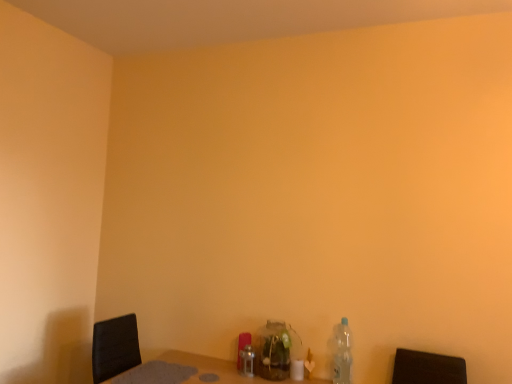
Question: From the image's perspective, would you say clear plastic bottle at lower right, marked as the third bottle in a left-to-right arrangement, is positioned over translucent glass jar at center, the 2th bottle in the right-to-left sequence?

Choices:
 (A) no
 (B) yes

Answer: (B)

Question: Could you tell me if clear plastic bottle at lower right, marked as the third bottle in a left-to-right arrangement, is turned towards translucent glass jar at center, placed as the second bottle when sorted from left to right?

Choices:
 (A) no
 (B) yes

Answer: (A)

Question: Is there a large distance between clear plastic bottle at lower right, the first bottle viewed from the right, and translucent glass jar at center, the 2th bottle in the right-to-left sequence?

Choices:
 (A) no
 (B) yes

Answer: (A)

Question: Is clear plastic bottle at lower right, the first bottle viewed from the right, further to the viewer compared to translucent glass jar at center, the 2th bottle in the right-to-left sequence?

Choices:
 (A) yes
 (B) no

Answer: (B)

Question: Is clear plastic bottle at lower right, marked as the third bottle in a left-to-right arrangement, at the right side of translucent glass jar at center, the 2th bottle in the right-to-left sequence?

Choices:
 (A) no
 (B) yes

Answer: (B)

Question: From the image's perspective, is clear plastic bottle at lower right, the first bottle viewed from the right, located beneath translucent glass jar at center, placed as the second bottle when sorted from left to right?

Choices:
 (A) no
 (B) yes

Answer: (A)

Question: Is the depth of brushed metal bottle at center, arranged as the first bottle when viewed from the left, greater than that of clear plastic bottle at lower right, the first bottle viewed from the right?

Choices:
 (A) yes
 (B) no

Answer: (A)

Question: Considering the relative sizes of brushed metal bottle at center, the third bottle when ordered from right to left, and clear plastic bottle at lower right, the first bottle viewed from the right, in the image provided, is brushed metal bottle at center, the third bottle when ordered from right to left, bigger than clear plastic bottle at lower right, the first bottle viewed from the right,?

Choices:
 (A) no
 (B) yes

Answer: (A)

Question: Considering the relative positions of brushed metal bottle at center, arranged as the first bottle when viewed from the left, and clear plastic bottle at lower right, marked as the third bottle in a left-to-right arrangement, in the image provided, is brushed metal bottle at center, arranged as the first bottle when viewed from the left, to the left of clear plastic bottle at lower right, marked as the third bottle in a left-to-right arrangement, from the viewer's perspective?

Choices:
 (A) no
 (B) yes

Answer: (B)

Question: Could you tell me if brushed metal bottle at center, arranged as the first bottle when viewed from the left, is turned towards clear plastic bottle at lower right, the first bottle viewed from the right?

Choices:
 (A) no
 (B) yes

Answer: (A)

Question: From the image's perspective, is brushed metal bottle at center, arranged as the first bottle when viewed from the left, over clear plastic bottle at lower right, the first bottle viewed from the right?

Choices:
 (A) yes
 (B) no

Answer: (B)

Question: Is brushed metal bottle at center, the third bottle when ordered from right to left, outside clear plastic bottle at lower right, marked as the third bottle in a left-to-right arrangement?

Choices:
 (A) yes
 (B) no

Answer: (A)

Question: Does clear plastic bottle at lower right, marked as the third bottle in a left-to-right arrangement, have a greater height compared to brushed metal bottle at center, the third bottle when ordered from right to left?

Choices:
 (A) yes
 (B) no

Answer: (A)